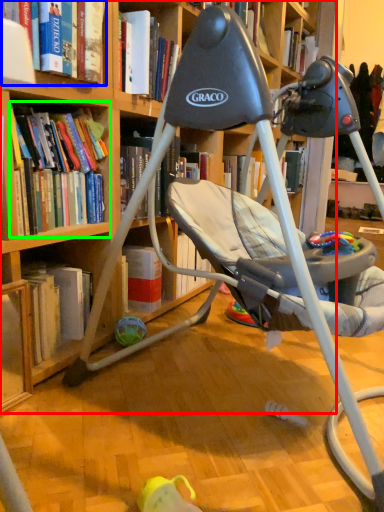
Question: Based on their relative distances, which object is farther from bookcase (highlighted by a red box)? Choose from book (highlighted by a blue box) and book (highlighted by a green box).

Choices:
 (A) book
 (B) book

Answer: (A)